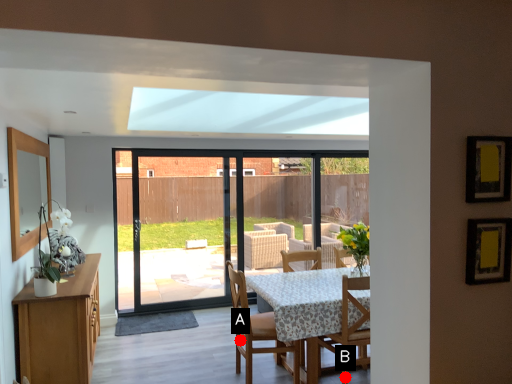
Question: Two points are circled on the image, labeled by A and B beside each circle. Which point appears farthest from the camera in this image?

Choices:
 (A) A is further
 (B) B is further

Answer: (A)